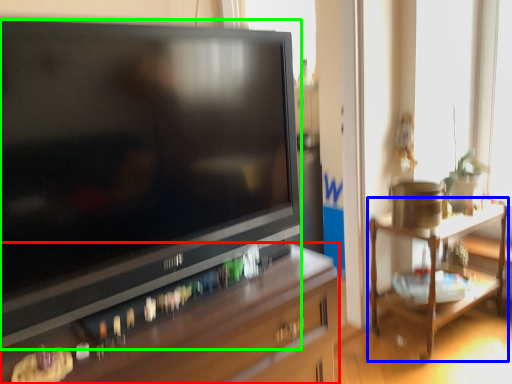
Question: Which is farther away from desk (highlighted by a red box)? table (highlighted by a blue box) or television (highlighted by a green box)?

Choices:
 (A) table
 (B) television

Answer: (A)